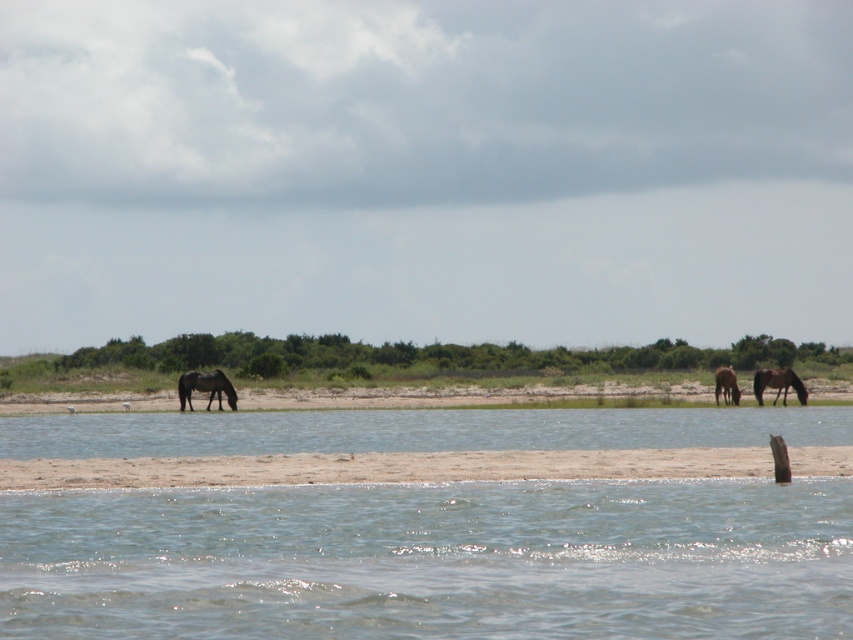
Question: Which point appears farthest from the camera in this image?

Choices:
 (A) (219, 408)
 (B) (323, 557)
 (C) (770, 372)

Answer: (A)

Question: Can you confirm if dark brown glossy horse at center is positioned to the right of brown glossy horse at right?

Choices:
 (A) yes
 (B) no

Answer: (B)

Question: Can you confirm if brown matte horse at right is positioned to the right of brown glossy horse at right?

Choices:
 (A) no
 (B) yes

Answer: (B)

Question: Which point appears closest to the camera in this image?

Choices:
 (A) (776, 396)
 (B) (190, 372)
 (C) (483, 566)
 (D) (723, 378)

Answer: (C)

Question: Is dark brown glossy horse at center above brown matte horse at right?

Choices:
 (A) yes
 (B) no

Answer: (B)

Question: Which point is closer to the camera?

Choices:
 (A) brown matte horse at right
 (B) dark brown glossy horse at center

Answer: (B)